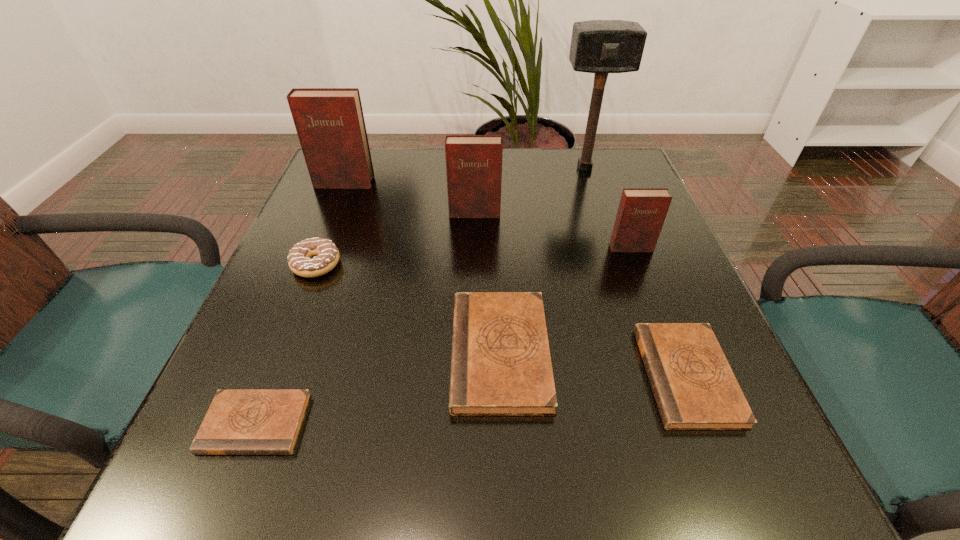
I want to click on blank space at the far right corner of the desktop, so click(x=571, y=161).

Image resolution: width=960 pixels, height=540 pixels. In the image, there is a desktop. Find the location of `vacant space at the near right corner`. vacant space at the near right corner is located at coordinates (755, 497).

Find the location of a particular element. This screenshot has height=540, width=960. vacant space that is in between the seventh shortest object and the second tallest diary is located at coordinates 409,198.

Locate an element on the screen. Image resolution: width=960 pixels, height=540 pixels. free spot between the farthest object and the second farthest reddish-brown diary is located at coordinates (529, 191).

You are a GUI agent. You are given a task and a screenshot of the screen. Output one action in this format:
    pyautogui.click(x=<x>, y=<y>)
    Task: Click on the empty space between the mallet and the sixth tallest object
    
    Given the screenshot: What is the action you would take?
    pyautogui.click(x=542, y=260)

Locate an element on the screen. free spot between the fifth tallest diary and the farthest object is located at coordinates (636, 272).

Identify the location of vacant area that lies between the biggest brown diary and the tallest object. (542, 260).

At what (x,y) coordinates should I click in order to perform the action: click on free space between the second shortest diary and the rightmost reddish-brown diary. Please return your answer as a coordinate pair (x, y). Looking at the image, I should click on (659, 312).

The image size is (960, 540). In order to click on empty space that is in between the smallest brown diary and the second tallest object in this screenshot , I will do `click(300, 303)`.

This screenshot has width=960, height=540. Find the location of `free point between the farthest reddish-brown diary and the leftmost brown diary`. free point between the farthest reddish-brown diary and the leftmost brown diary is located at coordinates (300, 303).